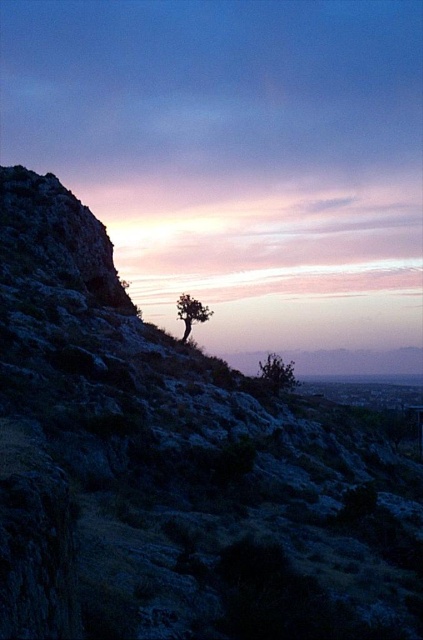
You are an environmental scientist assessing the landscape. You observe the green textured hillside at center and the green matte tree at center. Which of these two features occupies a greater horizontal space in the scene?

The green textured hillside at center has a larger width than the green matte tree at center, so it occupies more horizontal space in the scene.

You are a hiker who wants to take a photo of both the green leafy shrub at center and the green matte tree at center. Which one should you zoom in on to ensure both fit in the frame?

The green leafy shrub at center is smaller than the green matte tree at center, so you should zoom out to include both in the frame.